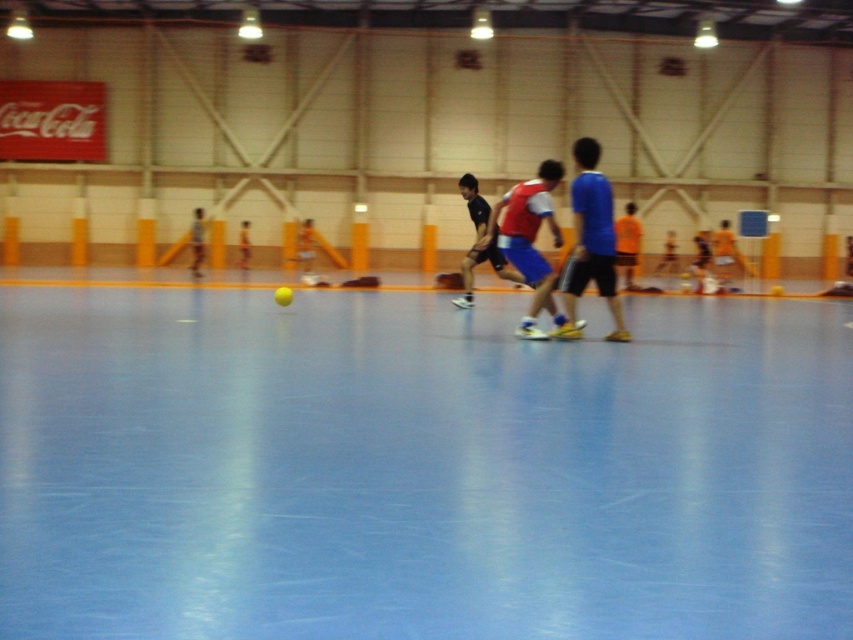
Is blue matte shorts at center taller than matte red jersey at center?

Correct, blue matte shorts at center is much taller as matte red jersey at center.

From the picture: Is blue matte shorts at center in front of matte red jersey at center?

Yes.

What do you see at coordinates (590, 241) in the screenshot? I see `blue matte shorts at center` at bounding box center [590, 241].

Where is `blue matte shorts at center`? blue matte shorts at center is located at coordinates (590, 241).